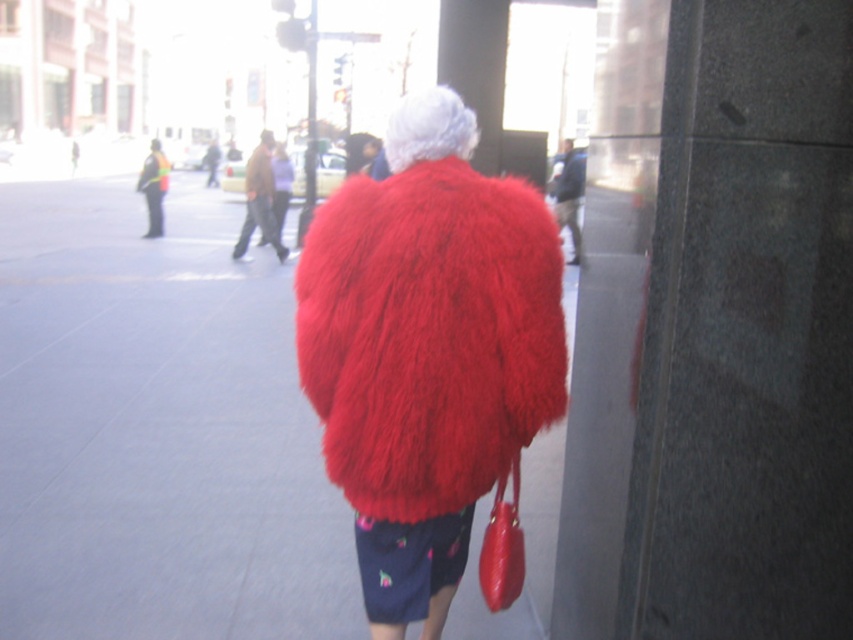
Which is more to the left, fuzzy red coat at center or shiny red handbag at lower right?

Positioned to the left is fuzzy red coat at center.

Who is more forward, (491,285) or (488,556)?

Positioned in front is point (491,285).

The height and width of the screenshot is (640, 853). In order to click on fuzzy red coat at center in this screenshot , I will do `click(427, 349)`.

Is point (167, 348) positioned before point (508, 472)?

That is False.

Does point (228, 291) lie behind point (497, 595)?

Yes, it is behind point (497, 595).

Identify the location of red fluffy coat at center. (157, 429).

Is point (48, 403) closer to camera compared to point (413, 154)?

No, it is not.

From the picture: How distant is red fluffy coat at center from fuzzy red coat at center?

red fluffy coat at center and fuzzy red coat at center are 9.51 feet apart from each other.

Is point (196, 324) closer to camera compared to point (331, 392)?

That is False.

You are a GUI agent. You are given a task and a screenshot of the screen. Output one action in this format:
    pyautogui.click(x=<x>, y=<y>)
    Task: Click on the red fluffy coat at center
    
    Given the screenshot: What is the action you would take?
    pyautogui.click(x=157, y=429)